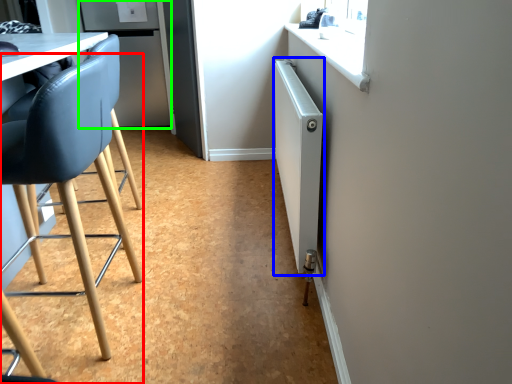
Question: Which object is the farthest from chair (highlighted by a red box)? Choose among these: radiator (highlighted by a blue box) or fridge (highlighted by a green box).

Choices:
 (A) radiator
 (B) fridge

Answer: (B)